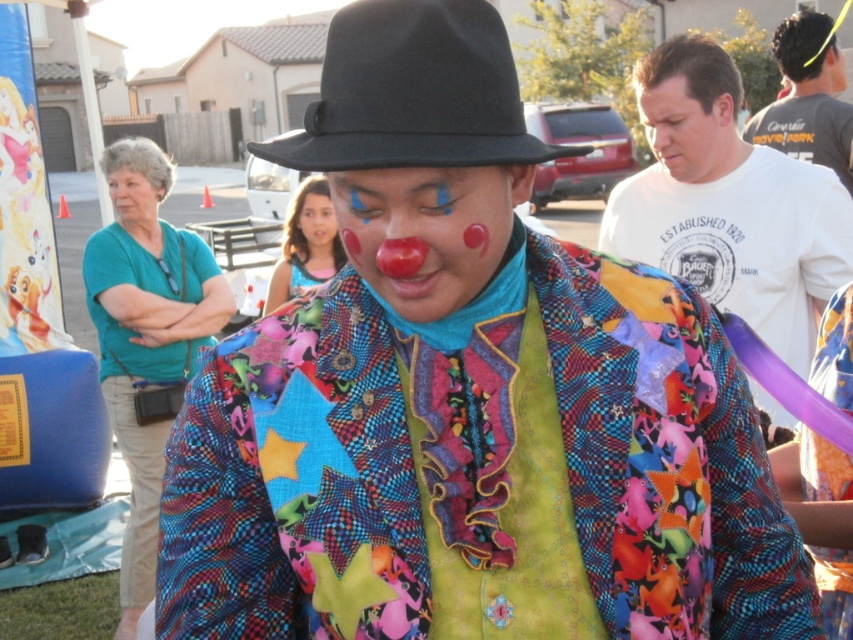
Question: Which point appears closest to the camera in this image?

Choices:
 (A) (822, 259)
 (B) (426, 218)
 (C) (837, 170)
 (D) (347, 136)

Answer: (D)

Question: Among these objects, which one is farthest from the camera?

Choices:
 (A) black felt fedora at upper center
 (B) gray cotton t-shirt at upper right

Answer: (B)

Question: Can you confirm if matte clown nose at center is positioned to the left of smooth skin face at center?

Choices:
 (A) yes
 (B) no

Answer: (B)

Question: Does gray cotton t-shirt at upper right have a larger size compared to smooth skin face at center?

Choices:
 (A) no
 (B) yes

Answer: (B)

Question: Which point is closer to the camera?

Choices:
 (A) (328, 243)
 (B) (785, 124)

Answer: (B)

Question: Does white cotton t-shirt at upper right appear over smooth skin face at upper left?

Choices:
 (A) no
 (B) yes

Answer: (A)